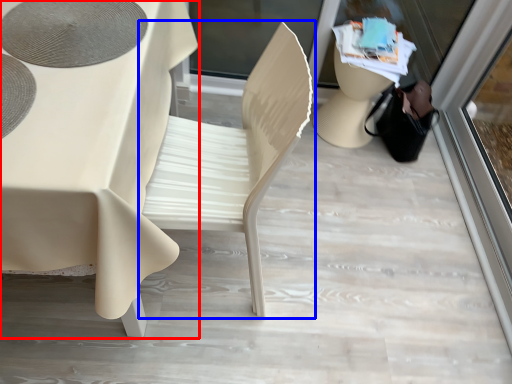
Question: Which of the following is the closest to the observer, table (highlighted by a red box) or chair (highlighted by a blue box)?

Choices:
 (A) table
 (B) chair

Answer: (A)